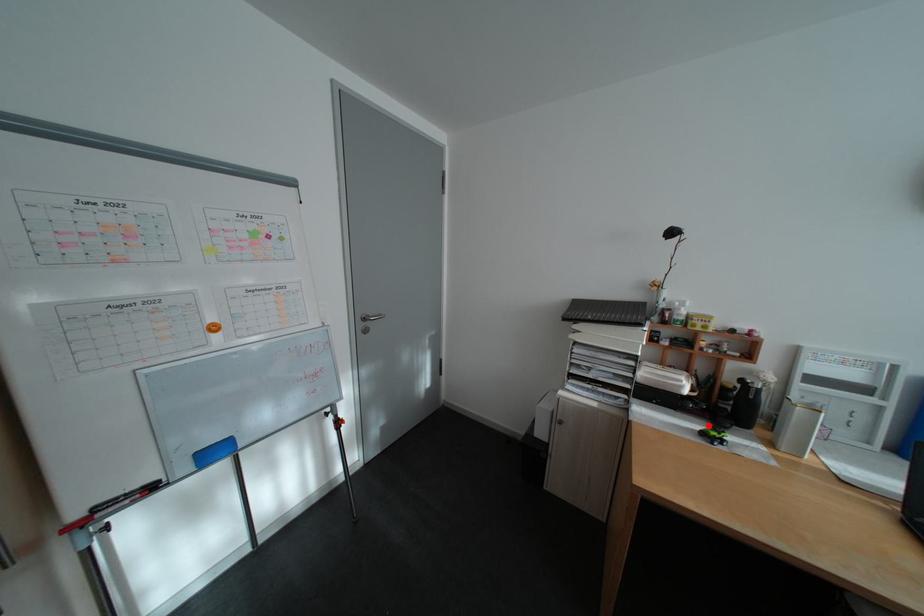
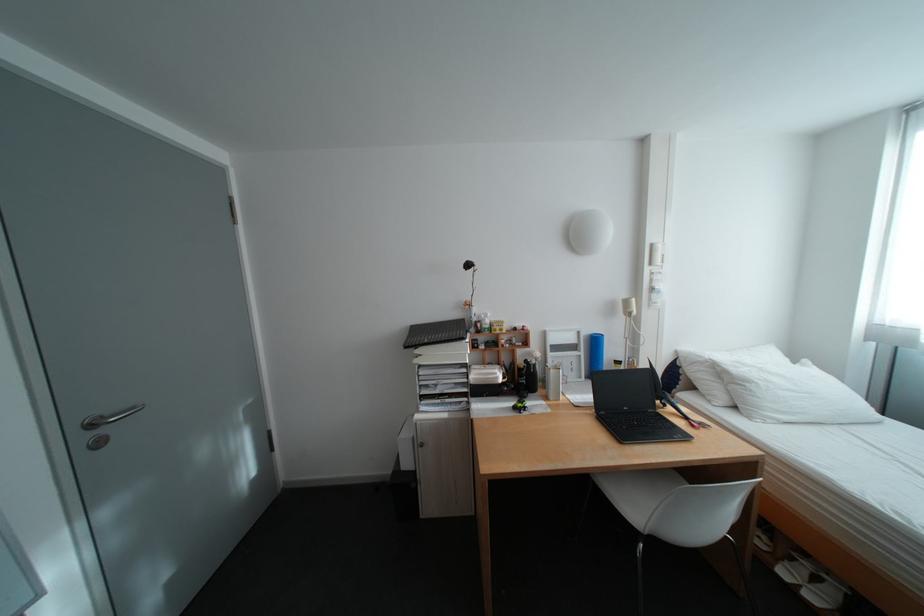
Question: I am providing you with two images of the same scene from different viewpoints. Given a red point in image1, look at the same physical point in image2. Is it:

Choices:
 (A) Closer to the viewpoint
 (B) Farther from the viewpoint

Answer: (B)